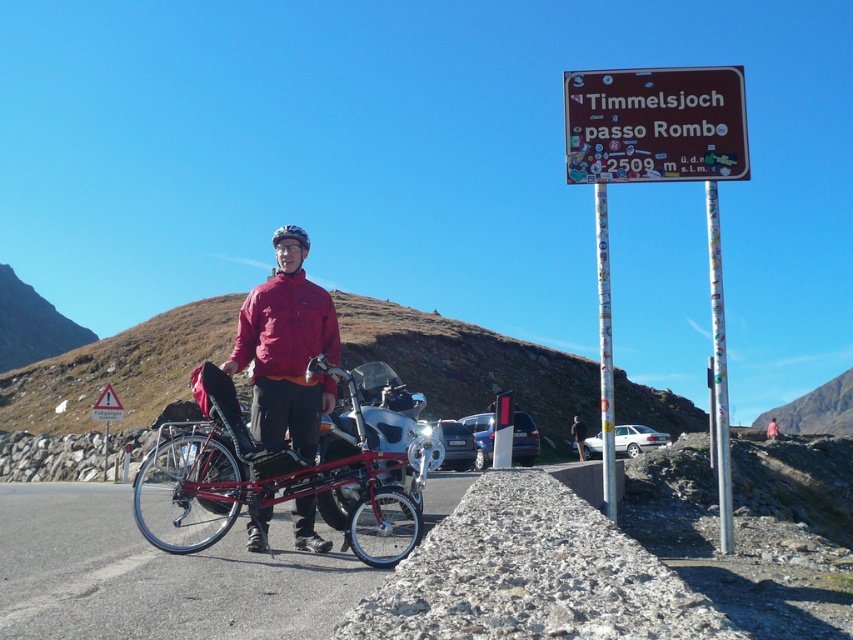
Question: Which object appears farthest from the camera in this image?

Choices:
 (A) pink fabric jacket at center
 (B) matte red jacket at center

Answer: (A)

Question: Which point is farther to the camera?

Choices:
 (A) (573, 440)
 (B) (115, 401)
 (C) (352, 500)

Answer: (A)

Question: Does shiny metallic bicycle at center have a greater width compared to yellow reflective triangle at upper left?

Choices:
 (A) no
 (B) yes

Answer: (B)

Question: Does brown/stained wood sign at upper right appear over yellow reflective triangle at upper left?

Choices:
 (A) yes
 (B) no

Answer: (A)

Question: Does brown leather jacket at center appear on the left side of pink fabric jacket at center?

Choices:
 (A) no
 (B) yes

Answer: (B)

Question: Which point is closer to the camera?

Choices:
 (A) yellow reflective triangle at upper left
 (B) pink fabric jacket at center

Answer: (A)